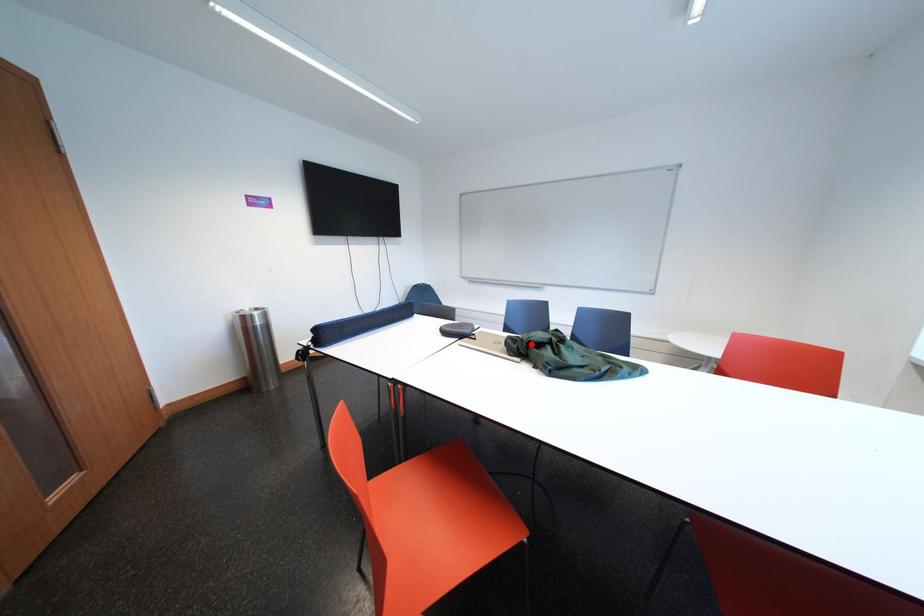
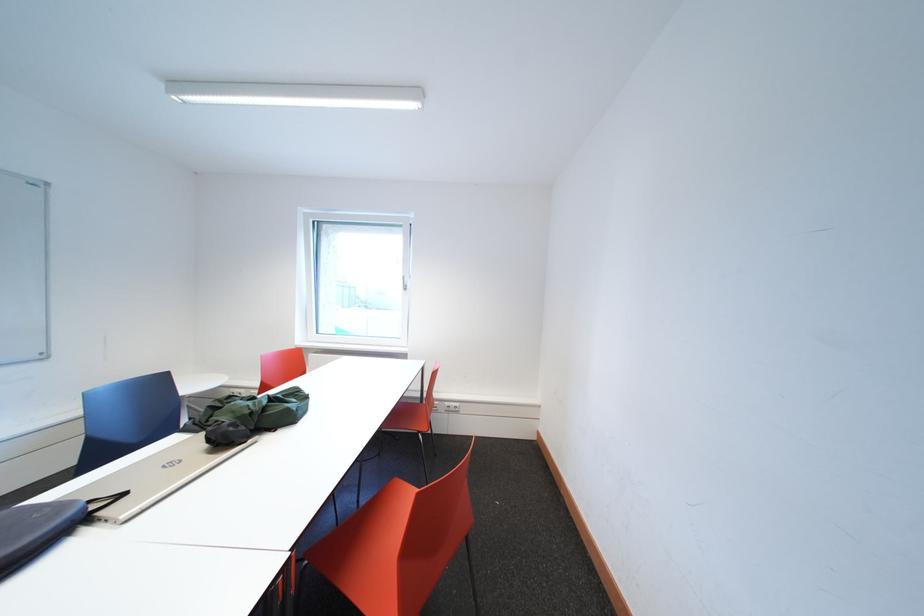
The point at the highlighted location is marked in the first image. Where is the corresponding point in the second image?

(261, 418)